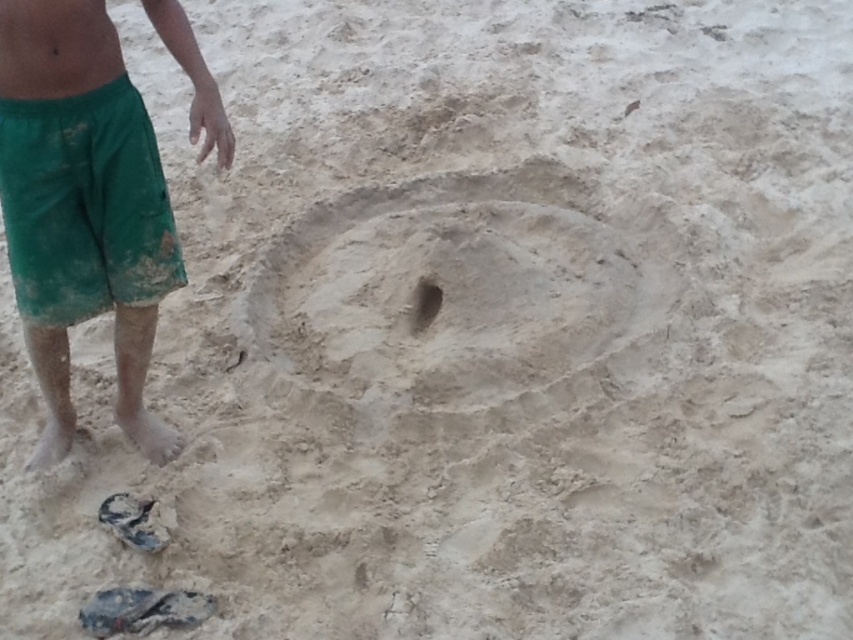
This screenshot has width=853, height=640. I want to click on green cotton shorts at left, so click(x=85, y=205).

Can you confirm if green cotton shorts at left is positioned above skinny bare torso at upper left?

No.

Who is more forward, (112, 212) or (33, 83)?

Point (33, 83) is more forward.

The height and width of the screenshot is (640, 853). In order to click on green cotton shorts at left in this screenshot , I will do `click(85, 205)`.

How much distance is there between green cotton shorts at left and green cotton shorts at lower left?

2.87 inches

Who is lower down, green cotton shorts at left or green cotton shorts at lower left?

green cotton shorts at lower left is below.

Locate an element on the screen. Image resolution: width=853 pixels, height=640 pixels. green cotton shorts at left is located at coordinates (85, 205).

Between skinny bare torso at upper left and smooth sand hole at center, which one has more height?

skinny bare torso at upper left

Between skinny bare torso at upper left and smooth sand hole at center, which one has less height?

smooth sand hole at center is shorter.

Describe the element at coordinates (55, 48) in the screenshot. I see `skinny bare torso at upper left` at that location.

At what (x,y) coordinates should I click in order to perform the action: click on skinny bare torso at upper left. Please return your answer as a coordinate pair (x, y). This screenshot has width=853, height=640. Looking at the image, I should click on (55, 48).